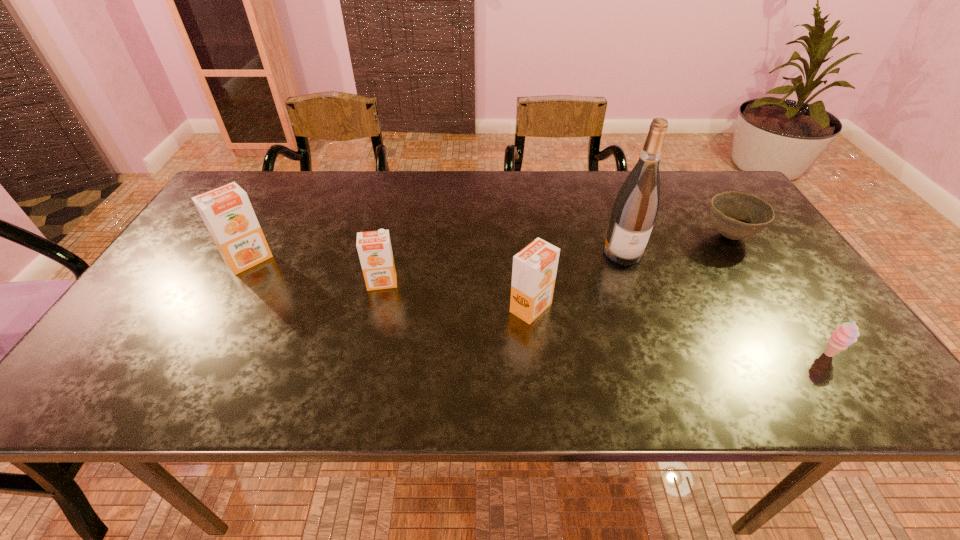
You are a GUI agent. You are given a task and a screenshot of the screen. Output one action in this format:
    pyautogui.click(x=<x>, y=<y>)
    Task: Click on the vacant space that satisfies the following two spatial constraints: 1. on the front side of the second tallest orange juice; 2. on the left side of the sherbert
    The width and height of the screenshot is (960, 540).
    Given the screenshot: What is the action you would take?
    pyautogui.click(x=536, y=355)

The width and height of the screenshot is (960, 540). In order to click on vacant space that satisfies the following two spatial constraints: 1. on the front side of the fifth farthest object; 2. on the left side of the leftmost object in this screenshot , I will do `click(222, 308)`.